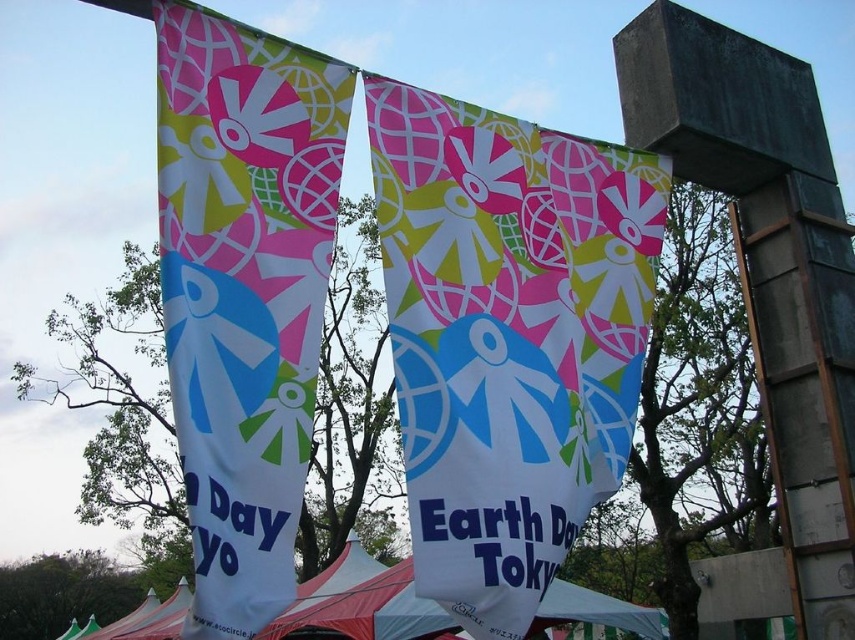
Can you confirm if matte fabric banner at center is taller than white fabric banner at center?

Yes, matte fabric banner at center is taller than white fabric banner at center.

Who is more forward, [561,433] or [202,404]?

Point [202,404]

Which is in front, point (528, 531) or point (205, 556)?

Point (205, 556) is in front.

Locate an element on the screen. Image resolution: width=855 pixels, height=640 pixels. matte fabric banner at center is located at coordinates (508, 337).

Is white fabric banner at center to the right of white fabric tent at lower center from the viewer's perspective?

Correct, you'll find white fabric banner at center to the right of white fabric tent at lower center.

Between white fabric banner at center and white fabric tent at lower center, which one is positioned lower?

white fabric tent at lower center is below.

Is point (313, 84) more distant than point (665, 632)?

No, (313, 84) is closer to viewer.

Identify the location of white fabric banner at center. This screenshot has width=855, height=640. (243, 292).

Which is more to the left, matte fabric banner at center or white fabric tent at lower center?

From the viewer's perspective, white fabric tent at lower center appears more on the left side.

The height and width of the screenshot is (640, 855). I want to click on matte fabric banner at center, so click(x=508, y=337).

Identify the location of matte fabric banner at center. (508, 337).